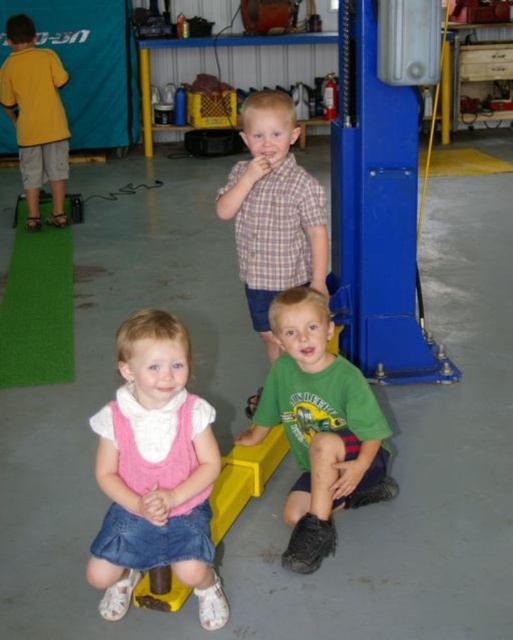
Does pink knitted vest at center appear over plaid shirt at center?

Actually, pink knitted vest at center is below plaid shirt at center.

Does point (106, 532) come in front of point (298, 225)?

Yes.

Locate an element on the screen. This screenshot has height=640, width=513. pink knitted vest at center is located at coordinates (155, 472).

Is pink knitted vest at center in front of matte yellow shirt at upper left?

Yes, pink knitted vest at center is closer to the viewer.

Does point (149, 340) lie in front of point (57, 84)?

Yes.

Find the location of a particular element. The height and width of the screenshot is (640, 513). pink knitted vest at center is located at coordinates (155, 472).

Is plaid shirt at center wider than matte yellow shirt at upper left?

No, plaid shirt at center is not wider than matte yellow shirt at upper left.

What do you see at coordinates (273, 211) in the screenshot? This screenshot has width=513, height=640. I see `plaid shirt at center` at bounding box center [273, 211].

Measure the distance between plaid shirt at center and camera.

7.67 feet

The width and height of the screenshot is (513, 640). Find the location of `plaid shirt at center`. plaid shirt at center is located at coordinates (273, 211).